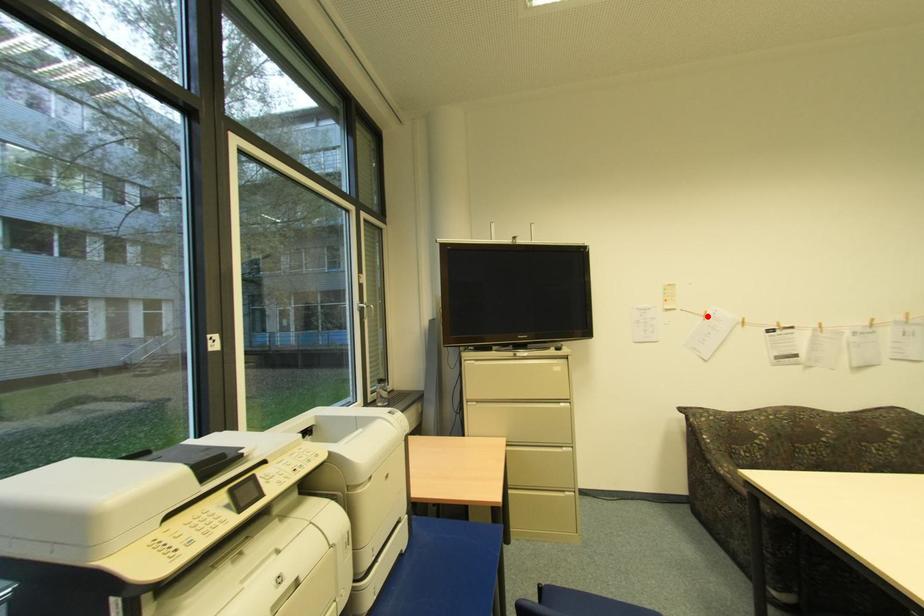
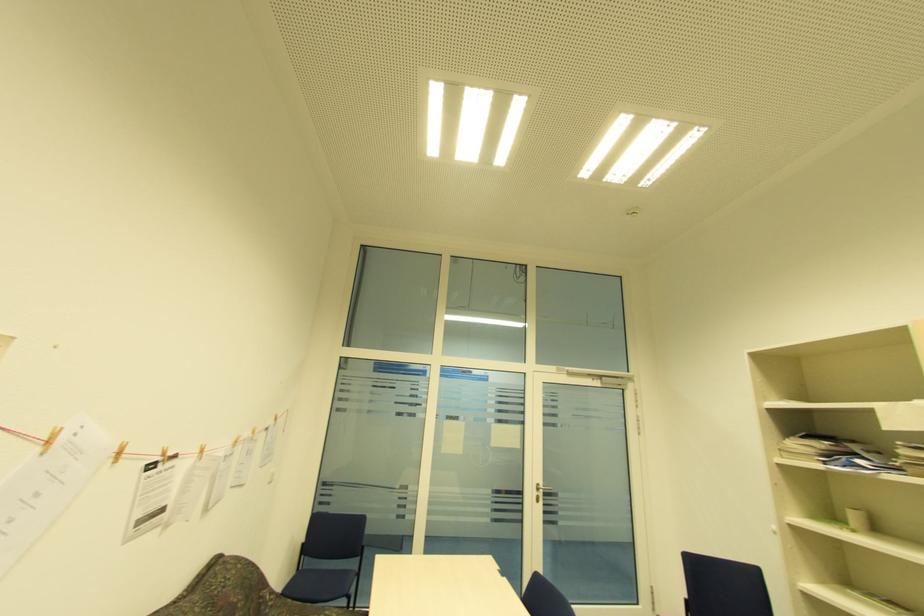
In the second image, find the point that corresponds to the highlighted location in the first image.

(51, 444)